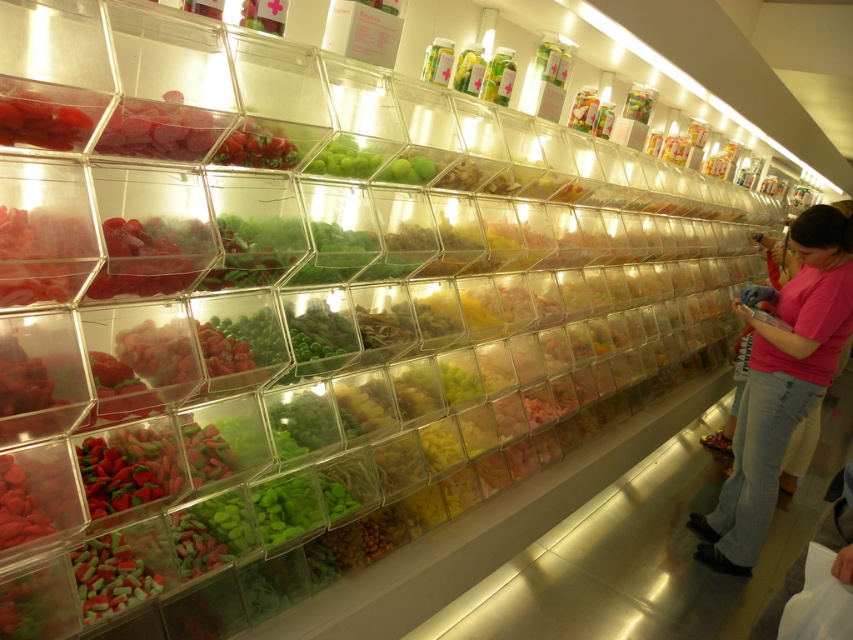
You are a customer in the candy shop and want to compare the sizes of the pink fabric shirt at right and the matte red candy at left. Which one is bigger?

The pink fabric shirt at right has a larger size compared to the matte red candy at left, so the pink fabric shirt at right is bigger.

You are a customer in the candy shop and notice the pink fabric shirt at right and the matte red candy at left. Which object is taller?

The pink fabric shirt at right is much taller than the matte red candy at left.